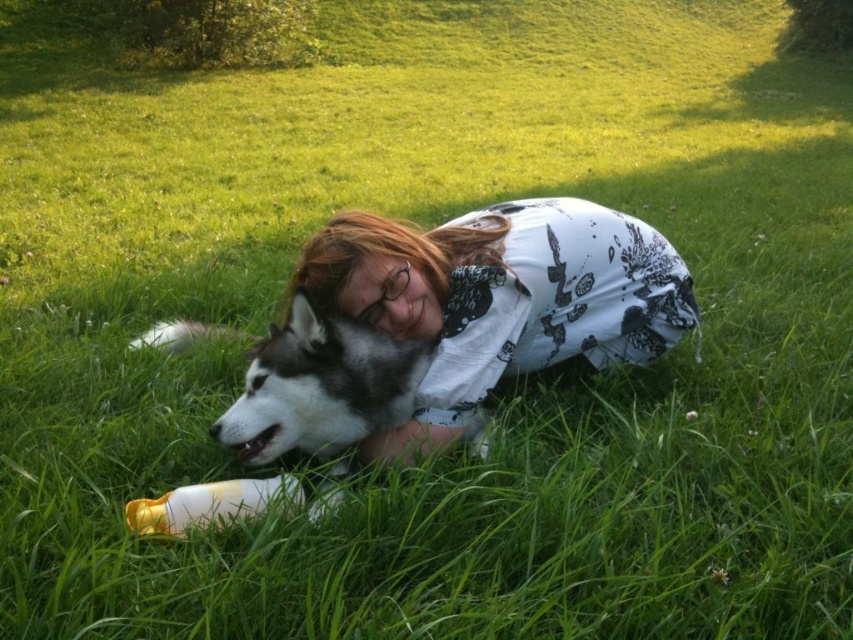
Question: In this image, where is white printed shirt at center located relative to gray-black fur dog at center?

Choices:
 (A) above
 (B) below

Answer: (A)

Question: Does white printed shirt at center come in front of yellow plastic bottle at lower left?

Choices:
 (A) no
 (B) yes

Answer: (A)

Question: Among these points, which one is farthest from the camera?

Choices:
 (A) (210, 330)
 (B) (165, 522)
 (C) (532, 198)

Answer: (C)

Question: Which point is farther from the camera taking this photo?

Choices:
 (A) (432, 404)
 (B) (245, 509)

Answer: (A)

Question: Which is nearer to the white printed shirt at center?

Choices:
 (A) gray-black fur dog at center
 (B) yellow plastic bottle at lower left

Answer: (A)

Question: Can you confirm if gray-black fur dog at center is wider than yellow plastic bottle at lower left?

Choices:
 (A) no
 (B) yes

Answer: (B)